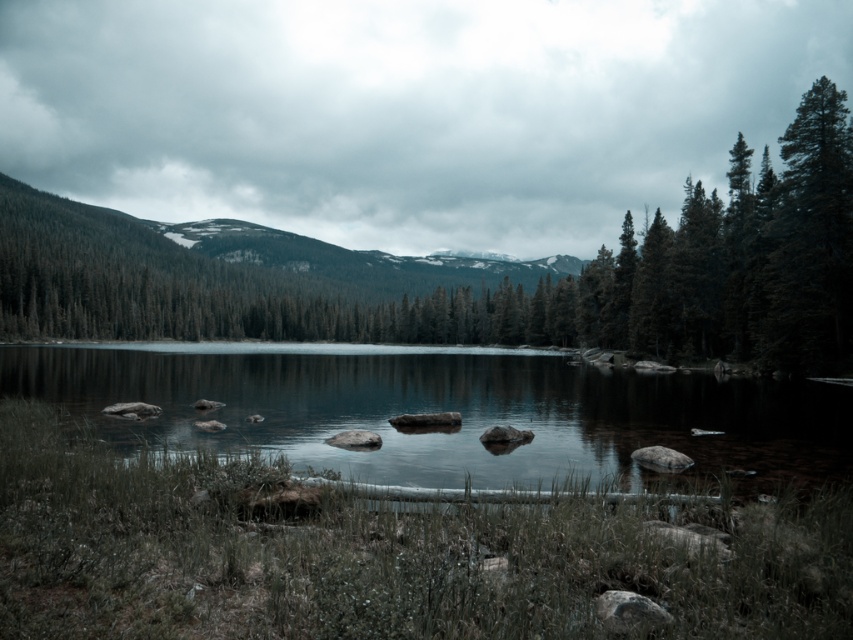
Which of these two, green matte tree at center or clear water at center, stands shorter?

clear water at center

Does green matte tree at center lie behind clear water at center?

Yes, it is.

Where is `green matte tree at center`? The height and width of the screenshot is (640, 853). green matte tree at center is located at coordinates (473, 273).

Locate an element on the screen. green matte tree at center is located at coordinates (473, 273).